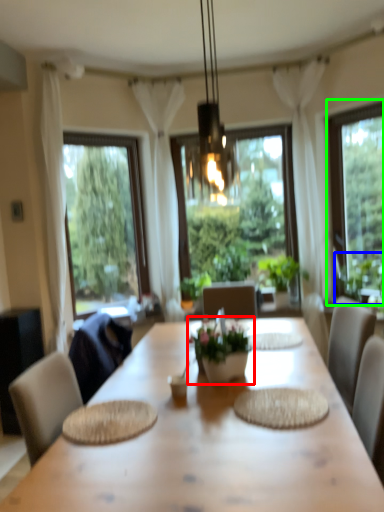
Question: Based on their relative distances, which object is nearer to houseplant (highlighted by a red box)? Choose from plant (highlighted by a blue box) and window (highlighted by a green box).

Choices:
 (A) plant
 (B) window

Answer: (A)